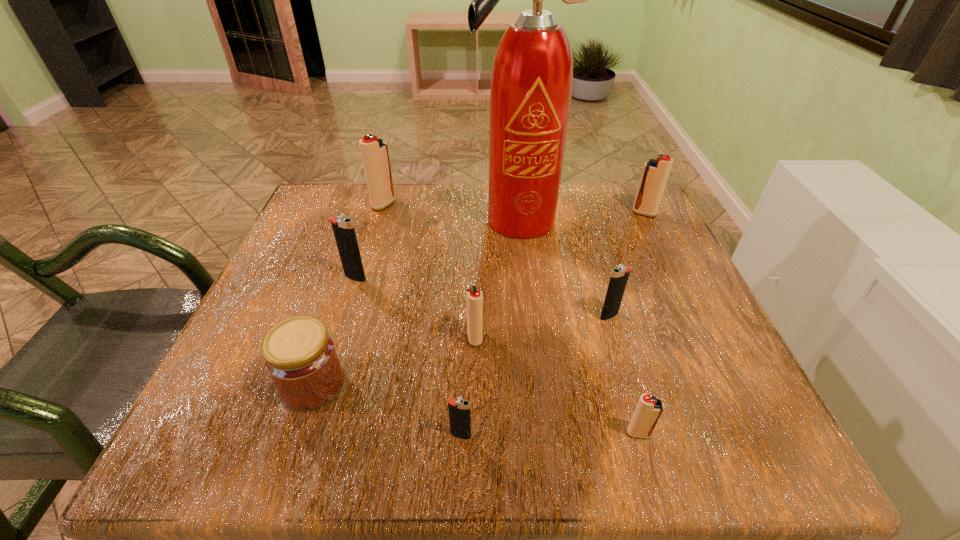
Identify the location of the tallest object. The width and height of the screenshot is (960, 540). (531, 84).

I want to click on red fire extinguisher, so [531, 84].

At what (x,y) coordinates should I click in order to perform the action: click on the leftmost red igniter. Please return your answer as a coordinate pair (x, y). Looking at the image, I should click on (374, 151).

Locate an element on the screen. the second tallest object is located at coordinates (374, 151).

What are the coordinates of `the rightmost red igniter` in the screenshot? It's located at (655, 173).

The height and width of the screenshot is (540, 960). What are the coordinates of `the third smallest red igniter` in the screenshot? It's located at (655, 173).

The image size is (960, 540). I want to click on the biggest black igniter, so click(x=344, y=232).

The height and width of the screenshot is (540, 960). I want to click on the third farthest igniter, so click(344, 232).

Locate an element on the screen. the second farthest black igniter is located at coordinates (619, 276).

The image size is (960, 540). I want to click on the rightmost black igniter, so click(x=619, y=276).